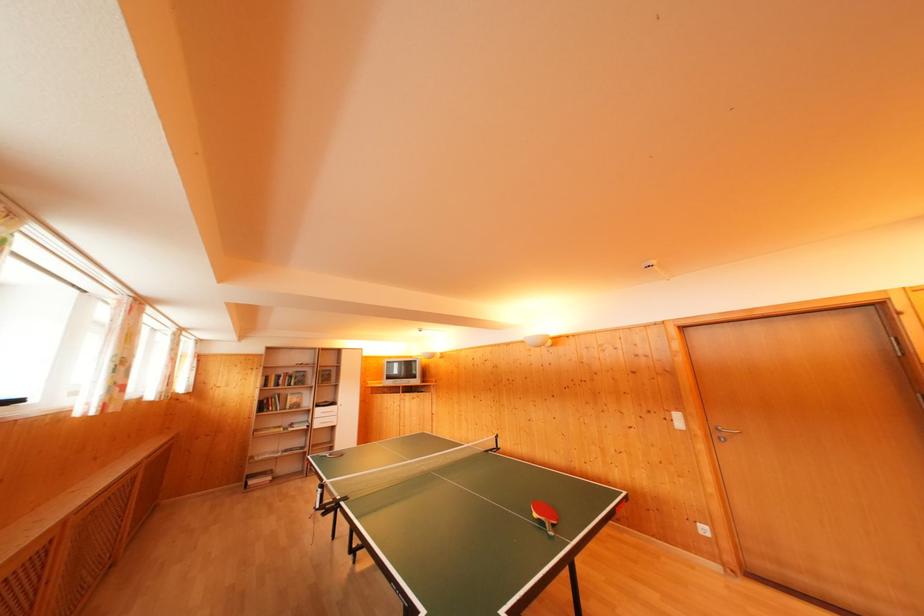
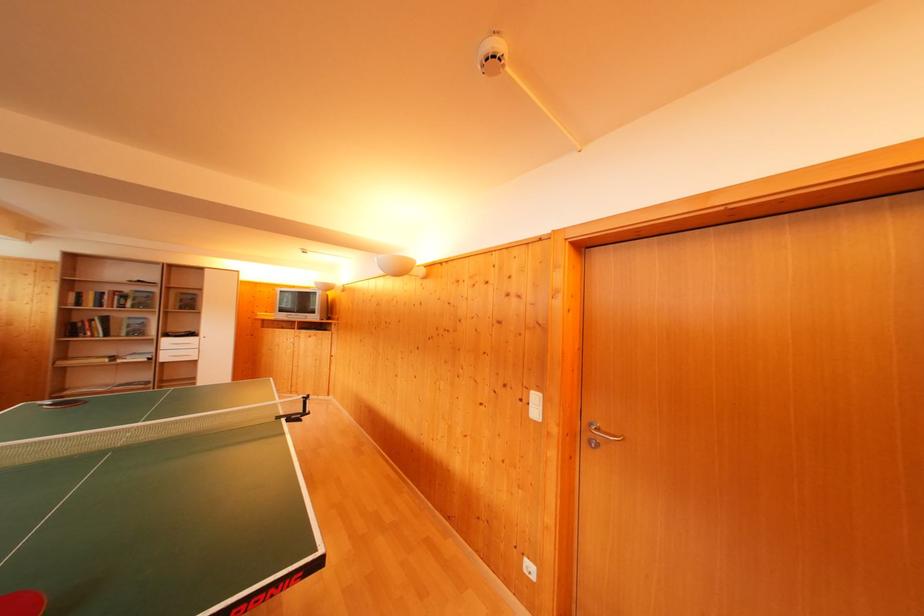
Find the pixel in the second image that matches the point at 268,411 in the first image.

(76, 334)